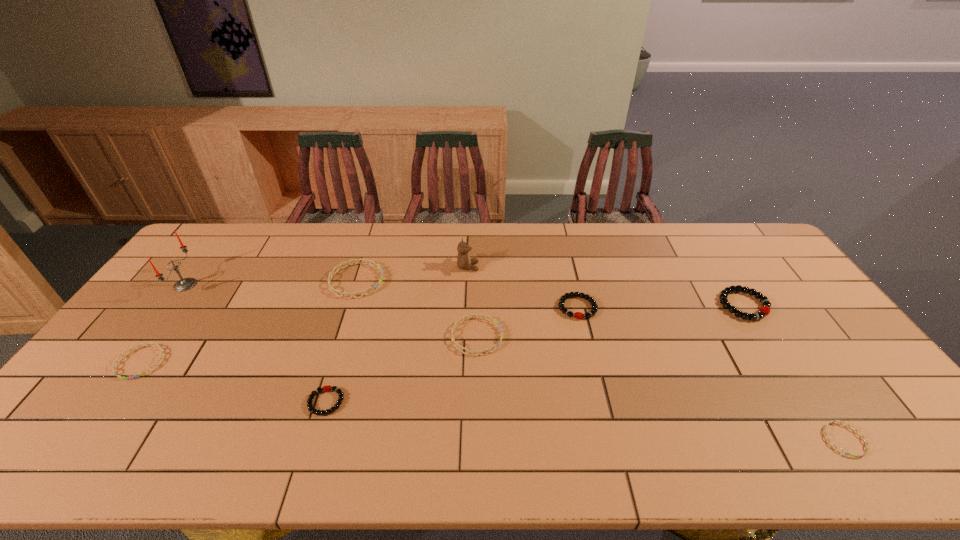
This screenshot has width=960, height=540. I want to click on the tallest object, so click(x=185, y=284).

Image resolution: width=960 pixels, height=540 pixels. What are the coordinates of `candle` in the screenshot? It's located at (185, 284).

The height and width of the screenshot is (540, 960). Find the location of `the eighth shortest object`. the eighth shortest object is located at coordinates (464, 262).

The image size is (960, 540). I want to click on brown teddy bear, so click(464, 262).

Where is `the farthest blue bracelet`? The height and width of the screenshot is (540, 960). the farthest blue bracelet is located at coordinates (357, 261).

Locate an element on the screen. The image size is (960, 540). the second blue bracelet from left to right is located at coordinates (357, 261).

Identify the location of the biggest black bracelet. This screenshot has width=960, height=540. (766, 305).

The image size is (960, 540). I want to click on the fourth bracelet from left to right, so click(x=482, y=316).

Locate an element on the screen. the third blue bracelet from left to right is located at coordinates (482, 316).

This screenshot has height=540, width=960. Find the location of `the second black bracelet from right to left`. the second black bracelet from right to left is located at coordinates (578, 315).